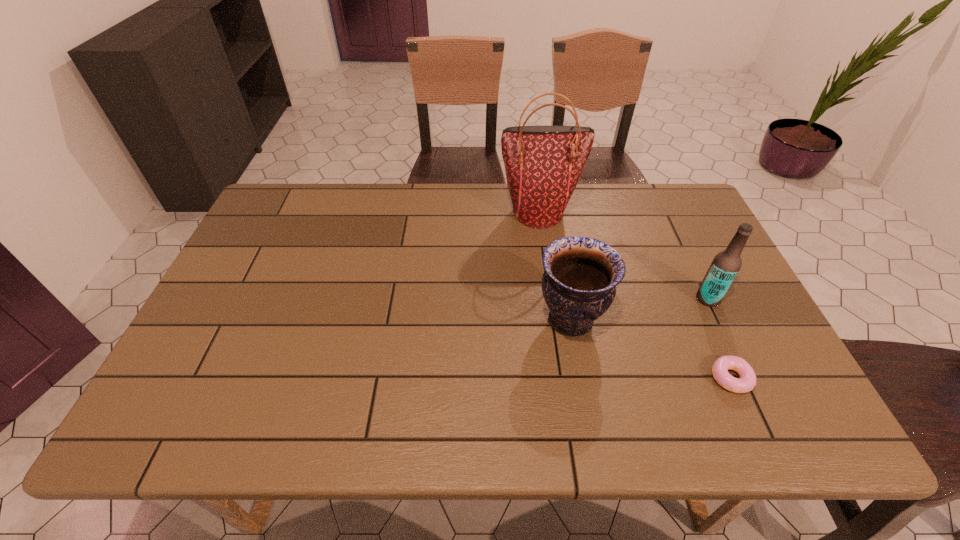
You are a GUI agent. You are given a task and a screenshot of the screen. Output one action in this format:
    pyautogui.click(x=<x>, y=<y>)
    Task: Click on the free space at the far right corner of the desktop
    The height and width of the screenshot is (540, 960).
    Given the screenshot: What is the action you would take?
    pyautogui.click(x=658, y=198)

Image resolution: width=960 pixels, height=540 pixels. I want to click on free space that is in between the third shortest object and the pottery, so click(x=639, y=309).

You are a GUI agent. You are given a task and a screenshot of the screen. Output one action in this format:
    pyautogui.click(x=<x>, y=<y>)
    Task: Click on the empty space that is in between the beer bottle and the tallest object
    This screenshot has width=960, height=540.
    Given the screenshot: What is the action you would take?
    pyautogui.click(x=623, y=255)

Locate an element on the screen. vacant area between the shortest object and the beer bottle is located at coordinates (720, 339).

Identify the location of free spot between the nearest object and the pottery. The width and height of the screenshot is (960, 540). (651, 349).

Where is `empty space that is in between the doughnut and the third tallest object`? empty space that is in between the doughnut and the third tallest object is located at coordinates (651, 349).

Locate an element on the screen. blank region between the second tallest object and the pottery is located at coordinates (639, 309).

Locate an element on the screen. Image resolution: width=960 pixels, height=540 pixels. free space between the pottery and the shortest object is located at coordinates (651, 349).

I want to click on unoccupied area between the shortest object and the pottery, so click(x=651, y=349).

This screenshot has width=960, height=540. What are the coordinates of `free space between the shortest object and the beer bottle` in the screenshot? It's located at (720, 339).